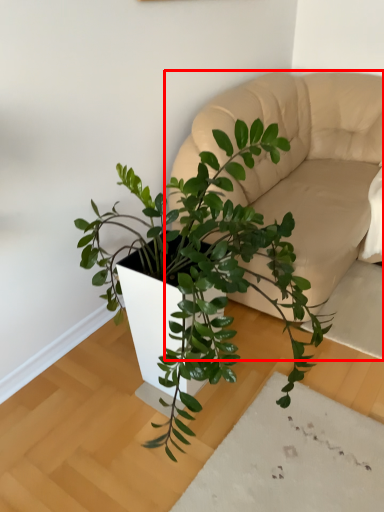
Question: From the image's perspective, what is the correct spatial relationship of couch (annotated by the red box) in relation to houseplant?

Choices:
 (A) below
 (B) above

Answer: (B)